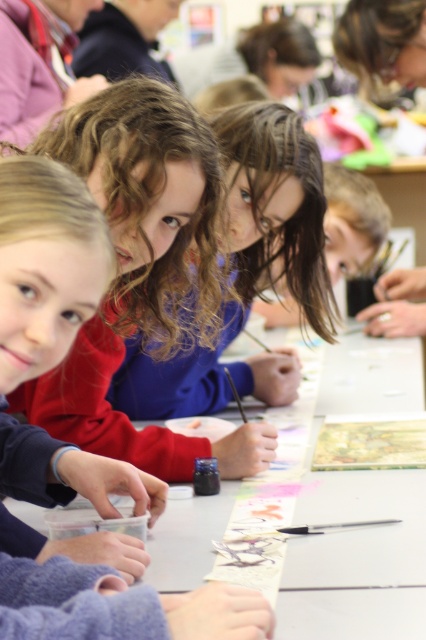
Question: Among these objects, which one is nearest to the camera?

Choices:
 (A) matte red sweater at center
 (B) blue fabric shirt at center

Answer: (A)

Question: Is matte red sweater at center to the right of white paper at center from the viewer's perspective?

Choices:
 (A) yes
 (B) no

Answer: (B)

Question: Among these points, which one is nearest to the camera?

Choices:
 (A) (348, 612)
 (B) (72, 413)

Answer: (A)

Question: Can you confirm if white paper at center is thinner than blue fabric shirt at center?

Choices:
 (A) no
 (B) yes

Answer: (A)

Question: Is matte red sweater at center positioned at the back of white paper at center?

Choices:
 (A) yes
 (B) no

Answer: (A)

Question: Considering the real-world distances, which object is closest to the white paper at center?

Choices:
 (A) matte red sweater at center
 (B) blue fabric shirt at center

Answer: (B)